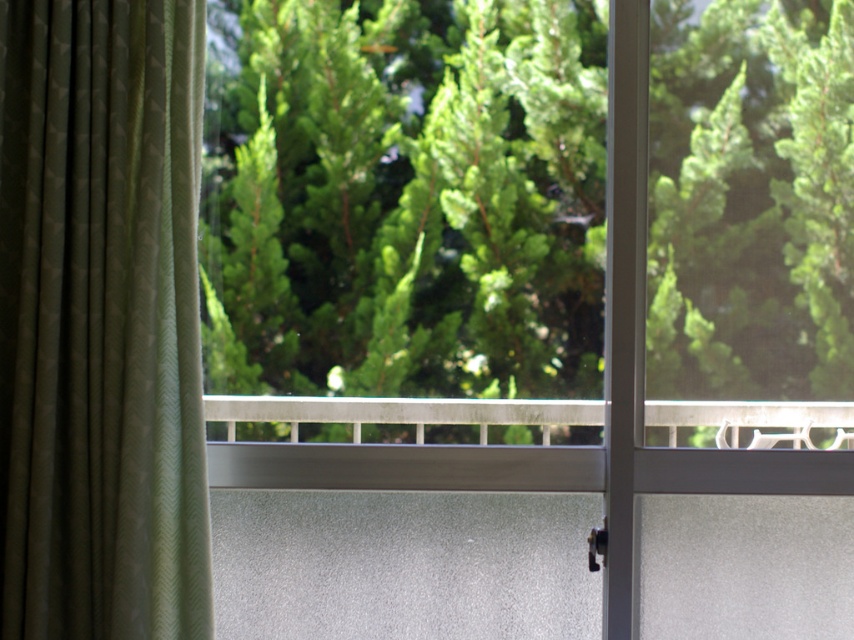
Based on the photo, is green leafy tree at upper center further to the viewer compared to satin silver rail at center?

Yes.

Does green leafy tree at upper center have a larger size compared to satin silver rail at center?

Yes.

Who is more distant from viewer, (430, 400) or (319, 413)?

The point (430, 400) is behind.

The image size is (854, 640). In order to click on green leafy tree at upper center in this screenshot , I will do `click(411, 221)`.

Is green textured curtain at left below satin silver rail at center?

Incorrect, green textured curtain at left is not positioned below satin silver rail at center.

Does green textured curtain at left have a larger size compared to satin silver rail at center?

Yes.

You are a GUI agent. You are given a task and a screenshot of the screen. Output one action in this format:
    pyautogui.click(x=<x>, y=<y>)
    Task: Click on the green textured curtain at left
    This screenshot has width=854, height=640.
    Given the screenshot: What is the action you would take?
    pyautogui.click(x=101, y=321)

I want to click on green textured curtain at left, so click(x=101, y=321).

Between green leafy tree at upper center and green textured curtain at left, which one is positioned lower?

green textured curtain at left

What do you see at coordinates (411, 221) in the screenshot? The image size is (854, 640). I see `green leafy tree at upper center` at bounding box center [411, 221].

The image size is (854, 640). In order to click on green leafy tree at upper center in this screenshot , I will do `click(411, 221)`.

Identify the location of green leafy tree at upper center. The height and width of the screenshot is (640, 854). (411, 221).